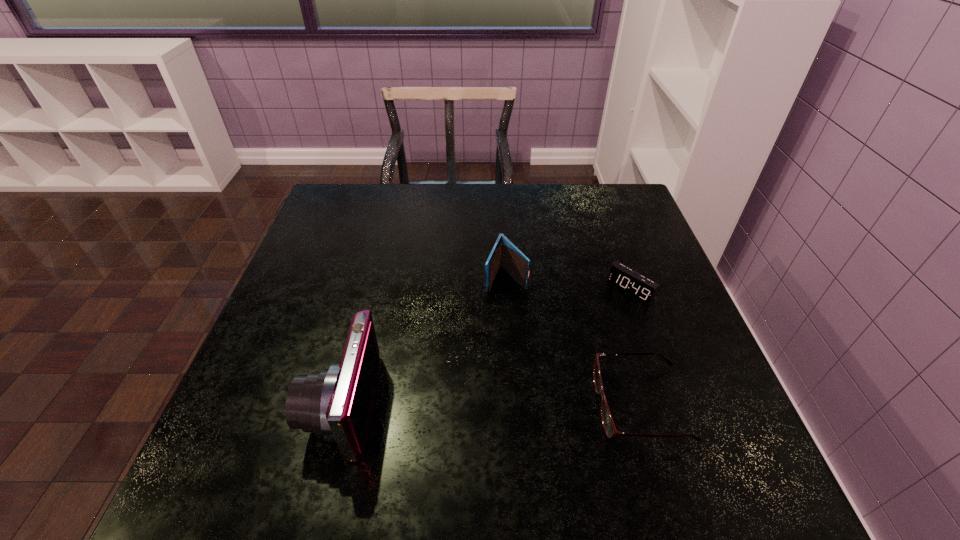
At what (x,y) coordinates should I click in order to perform the action: click on vacant space on the desktop that is between the camera and the spectacles and is positioned on the front-facing side of the alarm clock. Please return your answer as a coordinate pair (x, y). Looking at the image, I should click on (501, 404).

Image resolution: width=960 pixels, height=540 pixels. Find the location of `vacant space on the desktop that is between the tallest object and the shortest object and is positioned on the exterior surface of the wallet`. vacant space on the desktop that is between the tallest object and the shortest object and is positioned on the exterior surface of the wallet is located at coordinates (449, 404).